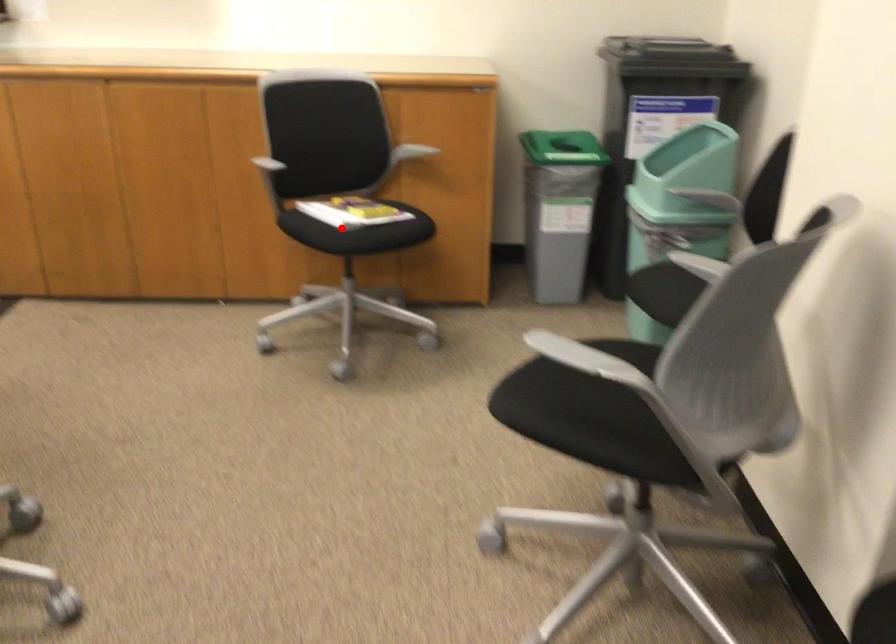
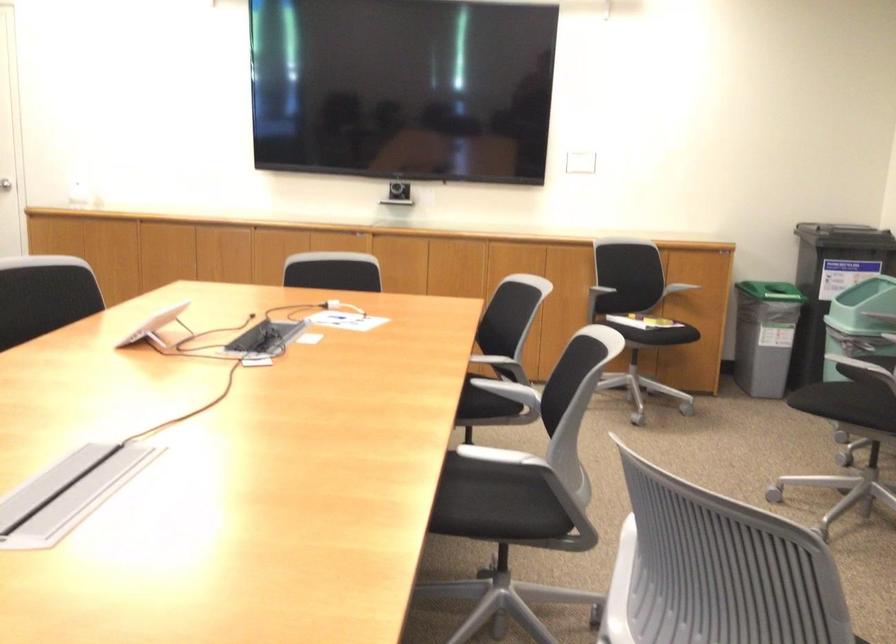
Where in the second image is the point corresponding to the highlighted location from the first image?

(636, 313)